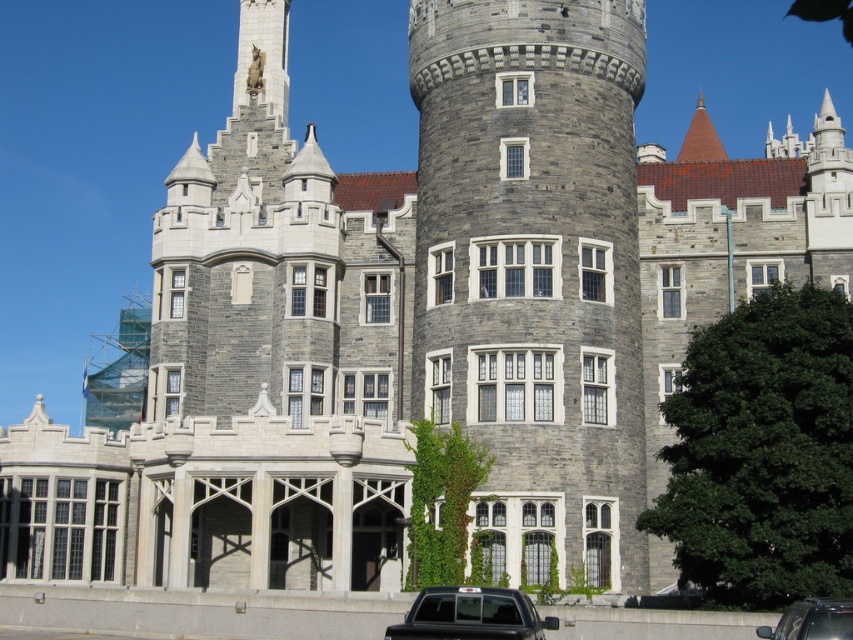
Who is more distant from viewer, (492, 449) or (843, 627)?

Positioned behind is point (492, 449).

Is gray stone tower at center taller than metallic silver car at lower right?

Yes, gray stone tower at center is taller than metallic silver car at lower right.

Between point (492, 236) and point (827, 618), which one is positioned behind?

Positioned behind is point (492, 236).

I want to click on gray stone tower at center, so (535, 260).

Find the location of a particular element. The image size is (853, 640). gray stone tower at center is located at coordinates (535, 260).

Between point (556, 35) and point (389, 634), which one is positioned in front?

Point (389, 634) is more forward.

Measure the distance between gray stone tower at center and camera.

The distance of gray stone tower at center from camera is 52.78 meters.

Where is `gray stone tower at center`? This screenshot has width=853, height=640. gray stone tower at center is located at coordinates (535, 260).

Based on the photo, how distant is black matte truck at lower center from metallic silver car at lower right?

A distance of 7.08 meters exists between black matte truck at lower center and metallic silver car at lower right.

Can you confirm if black matte truck at lower center is bigger than metallic silver car at lower right?

Indeed, black matte truck at lower center has a larger size compared to metallic silver car at lower right.

This screenshot has height=640, width=853. Identify the location of black matte truck at lower center. (469, 616).